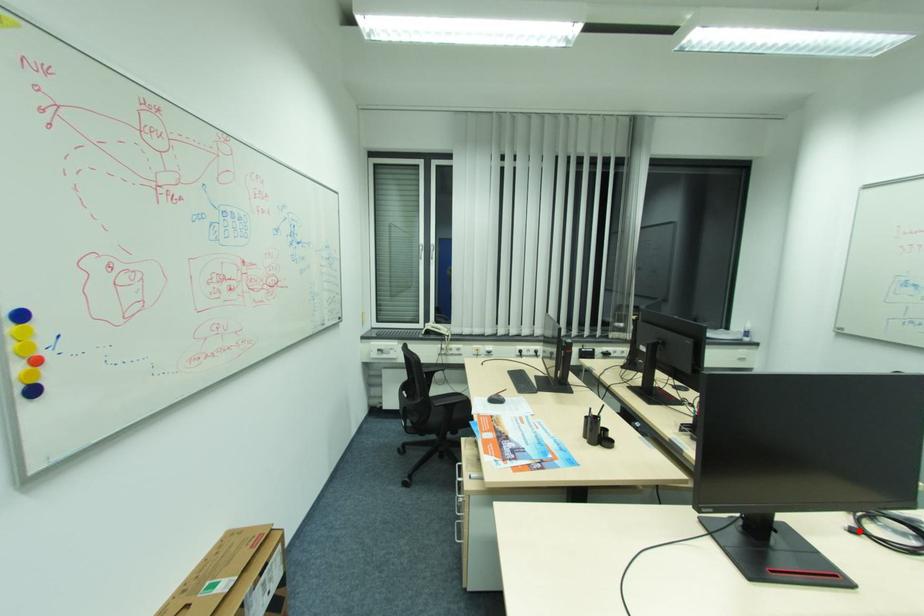
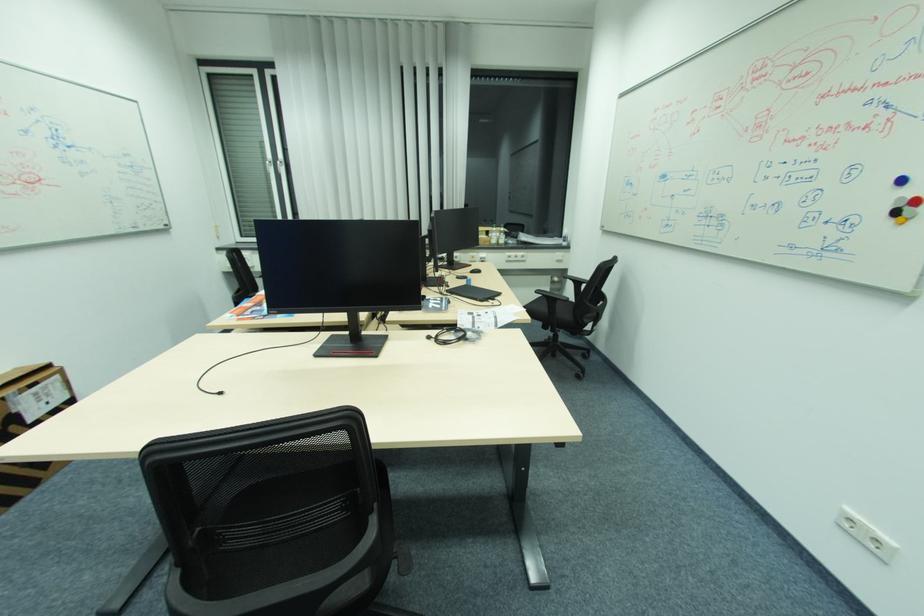
Where in the second image is the point corresponding to the highlighted location from the first image?

(434, 338)